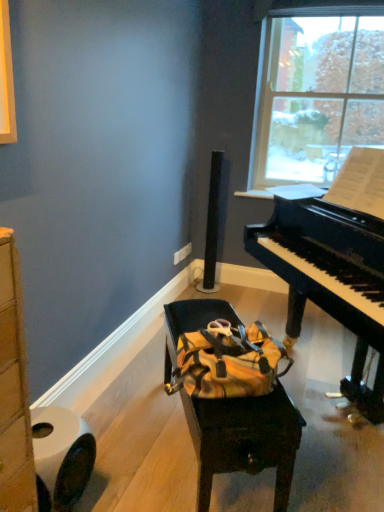
What are the coordinates of `blank space above white matte toilet paper at lower left (from a real-world perspective)` in the screenshot? It's located at (47, 432).